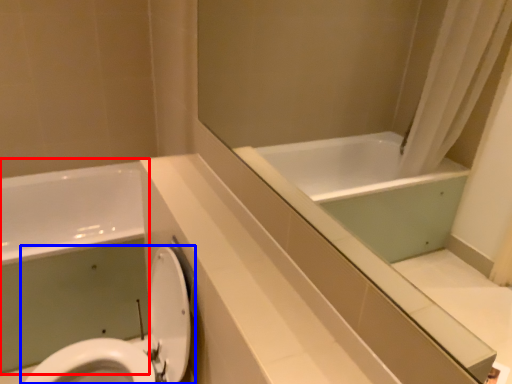
Question: Which object is closer to the camera taking this photo, bath (highlighted by a red box) or toilet (highlighted by a blue box)?

Choices:
 (A) bath
 (B) toilet

Answer: (B)